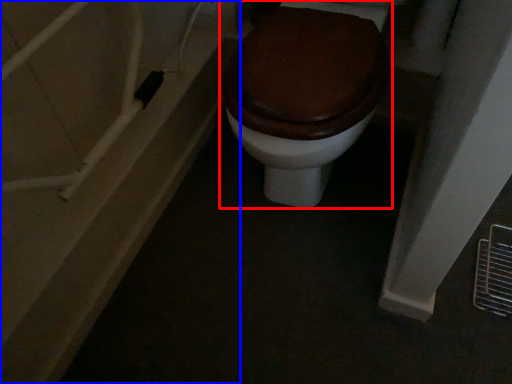
Question: Which object appears farthest to the camera in this image, toilet (highlighted by a red box) or bath (highlighted by a blue box)?

Choices:
 (A) toilet
 (B) bath

Answer: (B)